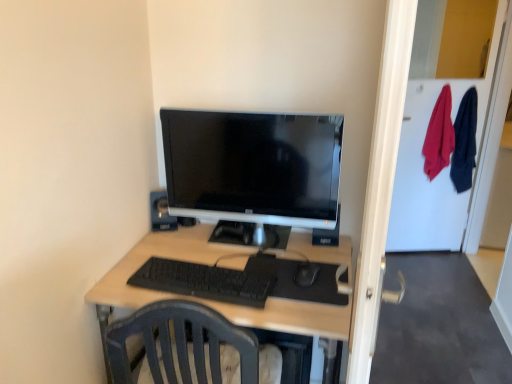
Question: Can you confirm if black plastic mouse at center is bigger than black plastic speaker at upper center?

Choices:
 (A) no
 (B) yes

Answer: (A)

Question: Can you confirm if black plastic mouse at center is shorter than black plastic speaker at upper center?

Choices:
 (A) no
 (B) yes

Answer: (B)

Question: Is black plastic mouse at center further to camera compared to black plastic speaker at upper center?

Choices:
 (A) no
 (B) yes

Answer: (A)

Question: Is black plastic mouse at center taller than black plastic speaker at upper center?

Choices:
 (A) yes
 (B) no

Answer: (B)

Question: From the image's perspective, is black plastic mouse at center beneath black plastic speaker at upper center?

Choices:
 (A) no
 (B) yes

Answer: (B)

Question: Is satin black monitor at center taller or shorter than transparent glass door at right?

Choices:
 (A) tall
 (B) short

Answer: (B)

Question: Is satin black monitor at center inside the boundaries of transparent glass door at right, or outside?

Choices:
 (A) inside
 (B) outside

Answer: (B)

Question: Considering the positions of satin black monitor at center and transparent glass door at right in the image, is satin black monitor at center bigger or smaller than transparent glass door at right?

Choices:
 (A) small
 (B) big

Answer: (A)

Question: From a real-world perspective, is satin black monitor at center positioned above or below transparent glass door at right?

Choices:
 (A) below
 (B) above

Answer: (B)

Question: Is satin black monitor at center inside or outside of light wood desk at center?

Choices:
 (A) outside
 (B) inside

Answer: (A)

Question: Relative to light wood desk at center, is satin black monitor at center in front or behind?

Choices:
 (A) front
 (B) behind

Answer: (B)

Question: In terms of height, does satin black monitor at center look taller or shorter compared to light wood desk at center?

Choices:
 (A) short
 (B) tall

Answer: (A)

Question: Is point 231,208 positioned closer to the camera than point 261,311?

Choices:
 (A) closer
 (B) farther

Answer: (B)

Question: Based on their sizes in the image, would you say black matte keyboard at center is bigger or smaller than transparent glass door at right?

Choices:
 (A) small
 (B) big

Answer: (A)

Question: Relative to transparent glass door at right, is black matte keyboard at center in front or behind?

Choices:
 (A) front
 (B) behind

Answer: (A)